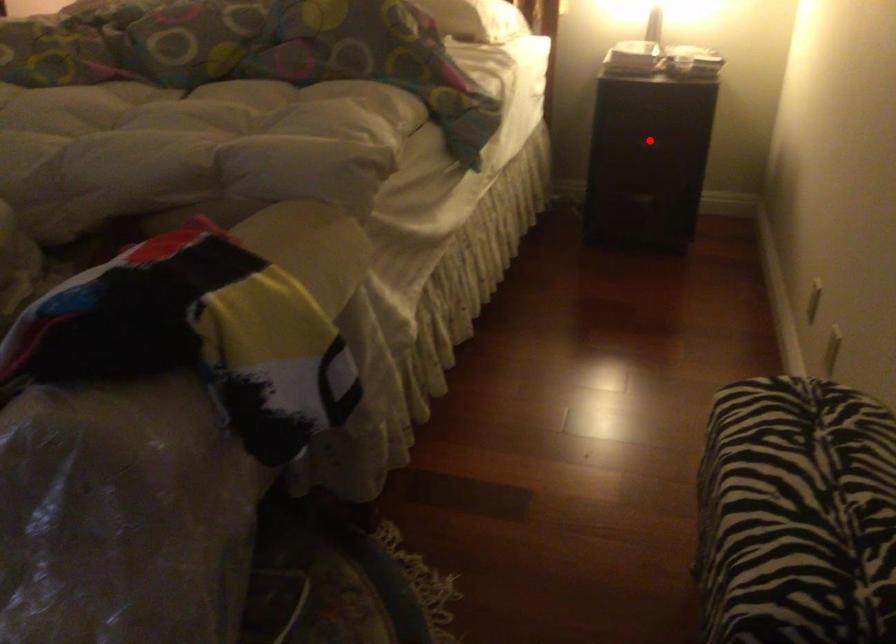
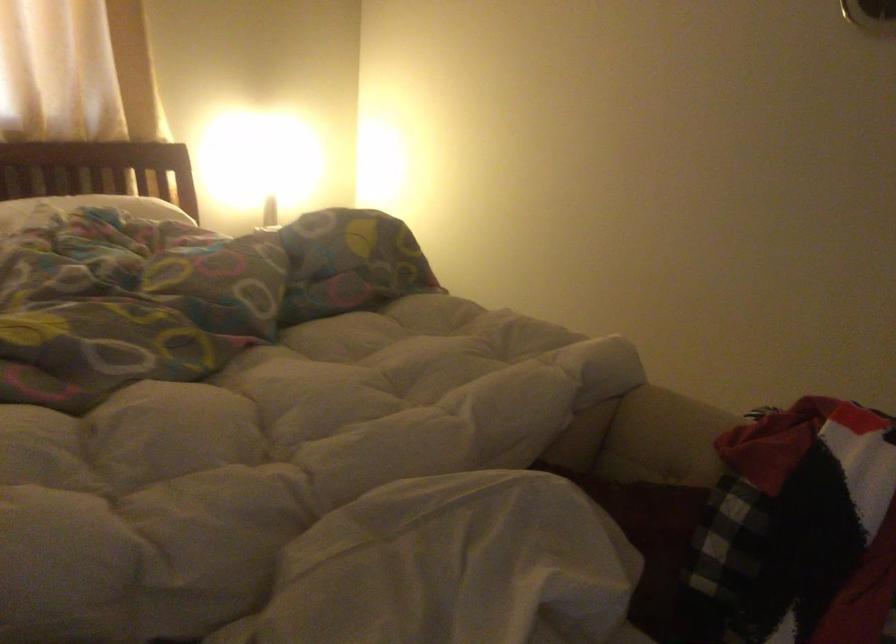
Question: I am providing you with two images of the same scene from different viewpoints. A red point is marked on the first image. Can you still see the location of the red point in image 2?

Choices:
 (A) Yes
 (B) No

Answer: (B)